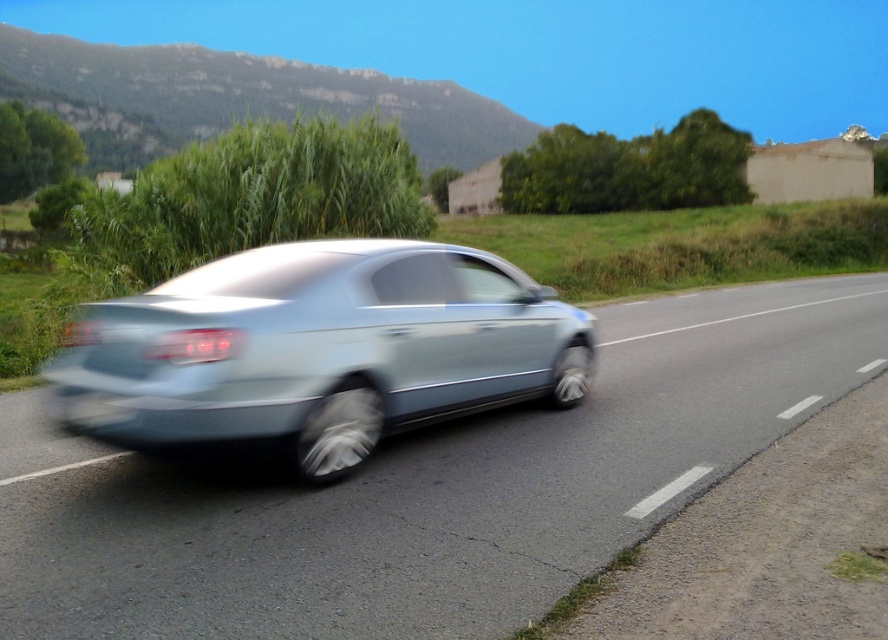
Question: In this image, where is metallic silver car at center located relative to satin silver car at center?

Choices:
 (A) below
 (B) above

Answer: (A)

Question: Does satin silver car at center have a greater width compared to black rubber license plate at rear?

Choices:
 (A) no
 (B) yes

Answer: (B)

Question: Can you confirm if metallic silver car at center is positioned to the left of black rubber license plate at rear?

Choices:
 (A) no
 (B) yes

Answer: (A)

Question: Estimate the real-world distances between objects in this image. Which object is closer to the black rubber license plate at rear?

Choices:
 (A) metallic silver car at center
 (B) satin silver car at center

Answer: (B)

Question: Which object is positioned closest to the metallic silver car at center?

Choices:
 (A) satin silver car at center
 (B) black rubber license plate at rear

Answer: (B)

Question: Based on their relative distances, which object is nearer to the black rubber license plate at rear?

Choices:
 (A) satin silver car at center
 (B) metallic silver car at center

Answer: (A)